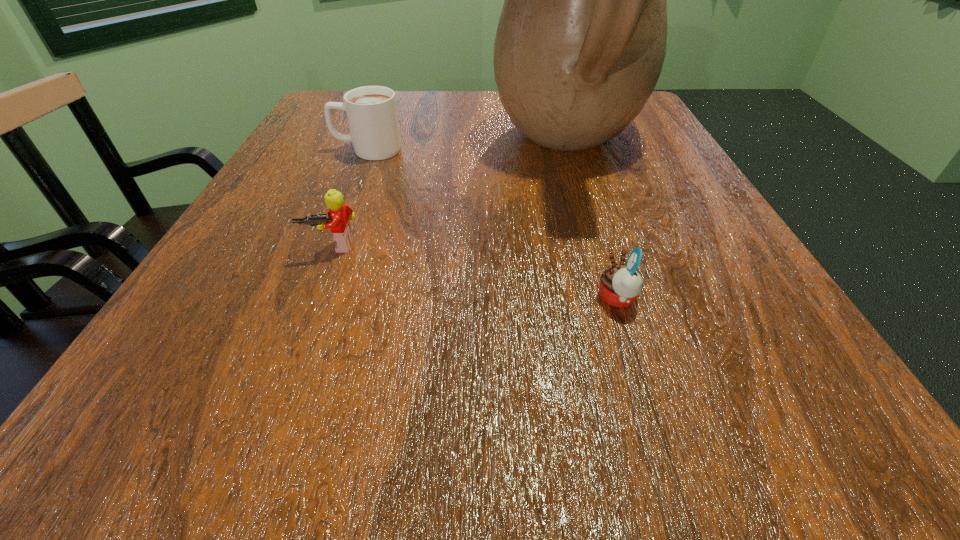
Image resolution: width=960 pixels, height=540 pixels. What are the coordinates of `free space between the third farthest object and the cappuccino` in the screenshot? It's located at (350, 198).

This screenshot has height=540, width=960. I want to click on free spot between the shortest object and the cream pitcher, so click(593, 222).

Where is `free space between the third tallest object and the cappuccino`? This screenshot has width=960, height=540. free space between the third tallest object and the cappuccino is located at coordinates (350, 198).

Identify which object is the closest to the cappuccino. Please provide its 2D coordinates. Your answer should be formatted as a tuple, i.e. [(x, y)], where the tuple contains the x and y coordinates of a point satisfying the conditions above.

[(581, 40)]

Where is `object that stands as the third closest to the third tallest object`? The width and height of the screenshot is (960, 540). object that stands as the third closest to the third tallest object is located at coordinates (620, 285).

Identify the location of free space that satisfies the following two spatial constraints: 1. at the spout of the cream pitcher; 2. in front of the second nearest object with the accessory visible. The width and height of the screenshot is (960, 540). (601, 246).